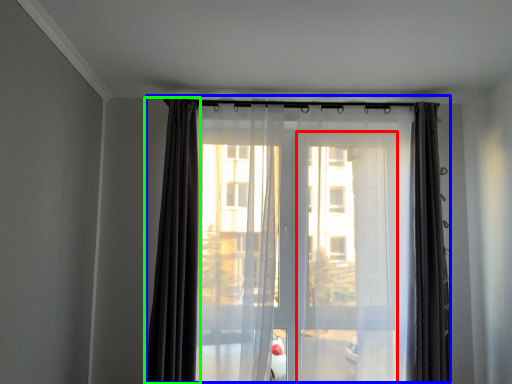
Question: Which object is the closest to the screen door (highlighted by a red box)? Choose among these: curtain (highlighted by a blue box) or curtain (highlighted by a green box).

Choices:
 (A) curtain
 (B) curtain

Answer: (B)